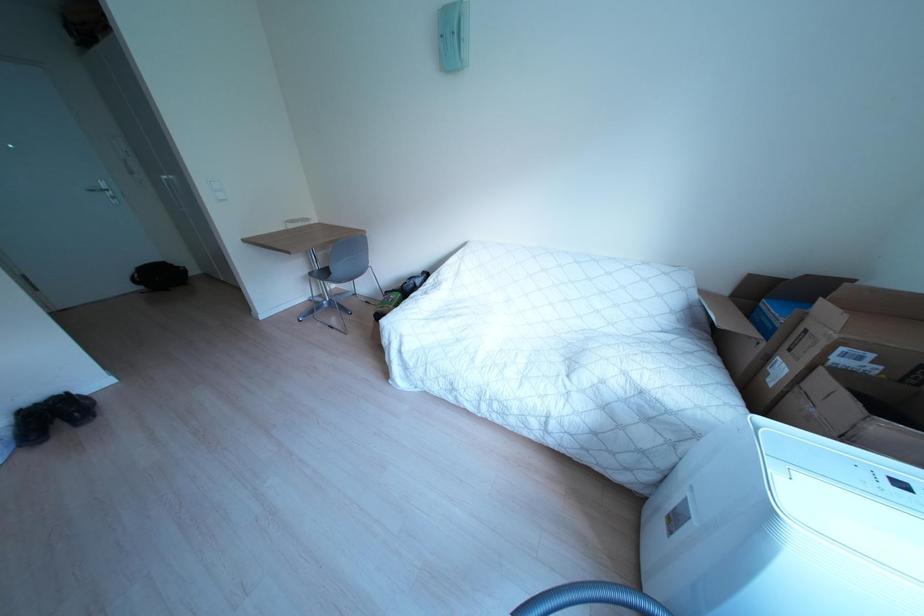
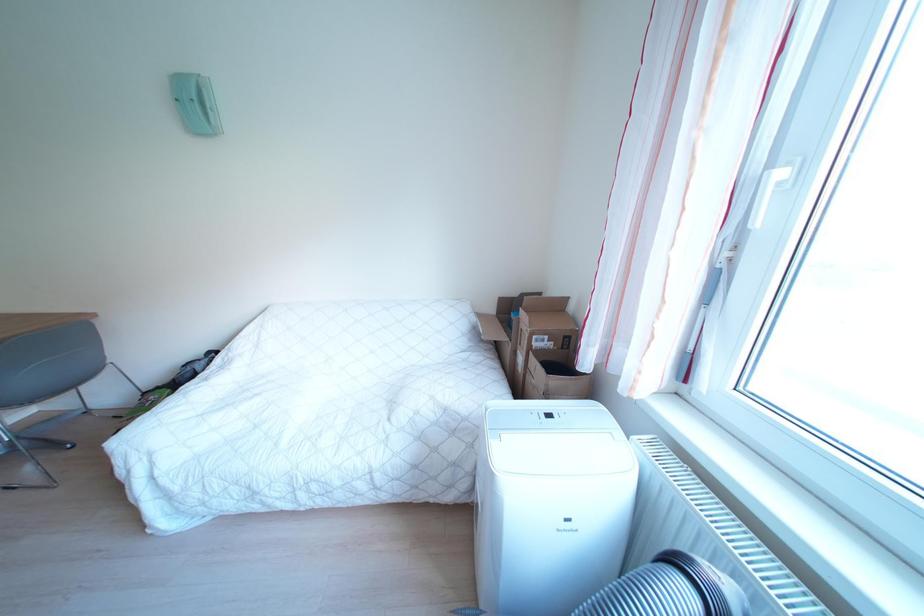
Question: How did the camera likely rotate?

Choices:
 (A) Left
 (B) Right
 (C) Up
 (D) Down

Answer: (B)